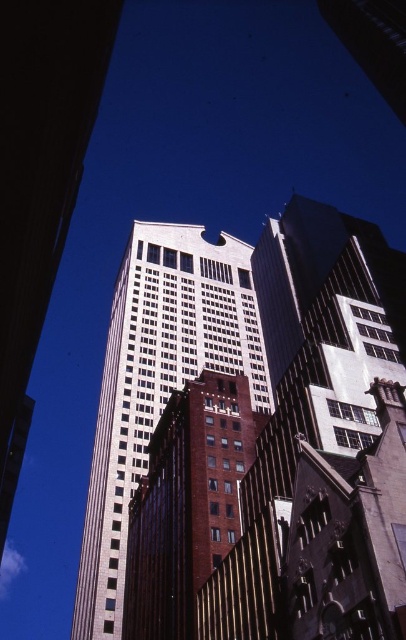
You are a city planner analyzing the layout of the urban scene. You notice the white glass building at center and the brown brick building at center. Which of these two buildings is located to the left when viewed from the perspective of the image?

The white glass building at center is positioned on the left side of the brown brick building at center, so it is located to the left when viewed from the image perspective.

You are an architect analyzing the urban layout. Given that the white glass building at center and the brown brick building at center are both part of a new development, which one has a greater horizontal spread in terms of their base footprint?

The white glass building at center has a larger width than the brown brick building at center, so its base footprint is greater in horizontal spread.

You are standing at the base of the white glass building at center and want to walk to the brown brick building at center. How far will you have to walk?

The white glass building at center is 26.62 meters away from the brown brick building at center, so you will have to walk 26.62 meters to reach it.